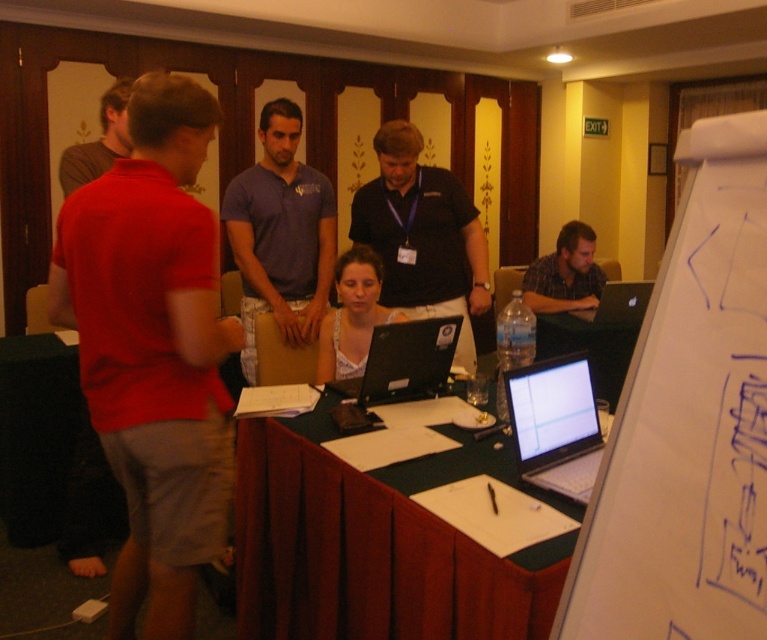
Consider the image. You are organizing a meeting and need to place a name tag for the person wearing the white lace top at center. Where should you place it relative to the silver metallic laptop at center?

The silver metallic laptop at center is positioned on the right side of the white lace top at center, so the name tag should be placed to the left of the laptop.

You are organizing a presentation and need to place a name tag on the plaid fabric shirt at center and the silver metallic laptop at right. Which object requires a larger name tag?

The plaid fabric shirt at center requires a larger name tag because it is larger in size than the silver metallic laptop at right.